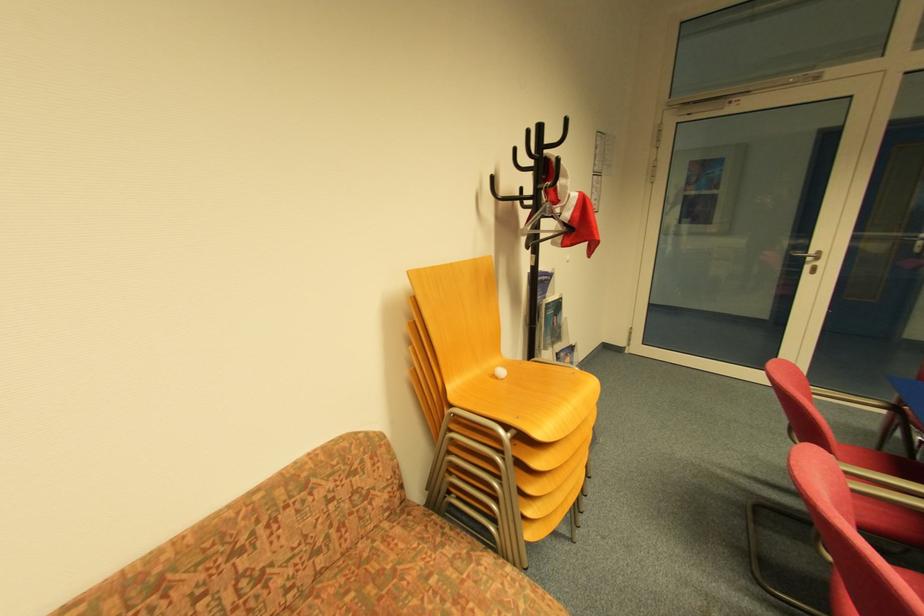
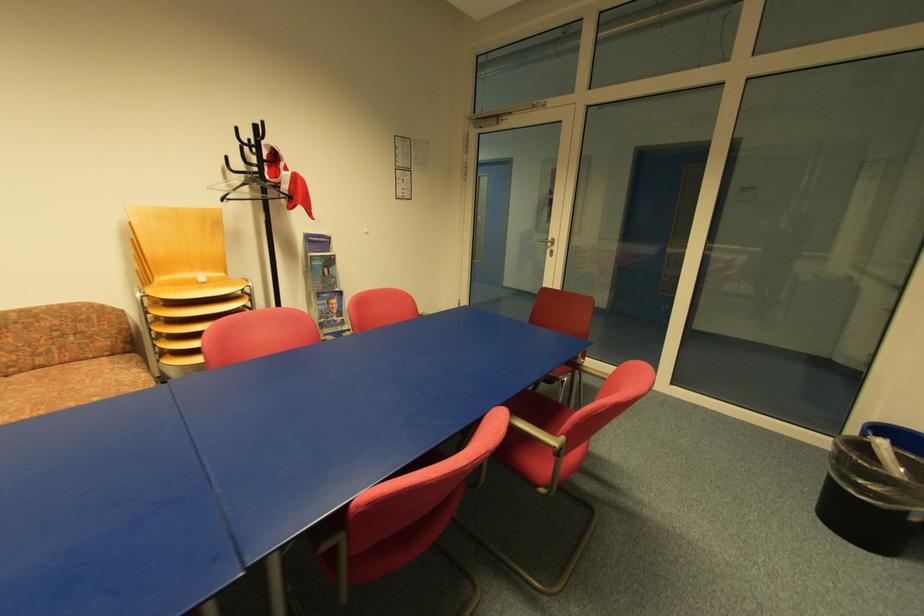
The point at (811, 254) is marked in the first image. Where is the corresponding point in the second image?

(551, 241)